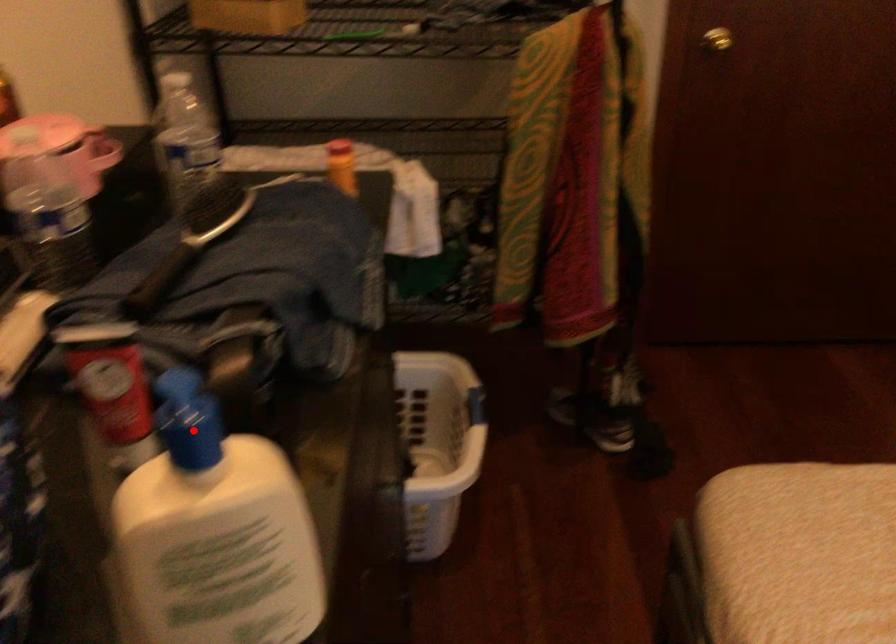
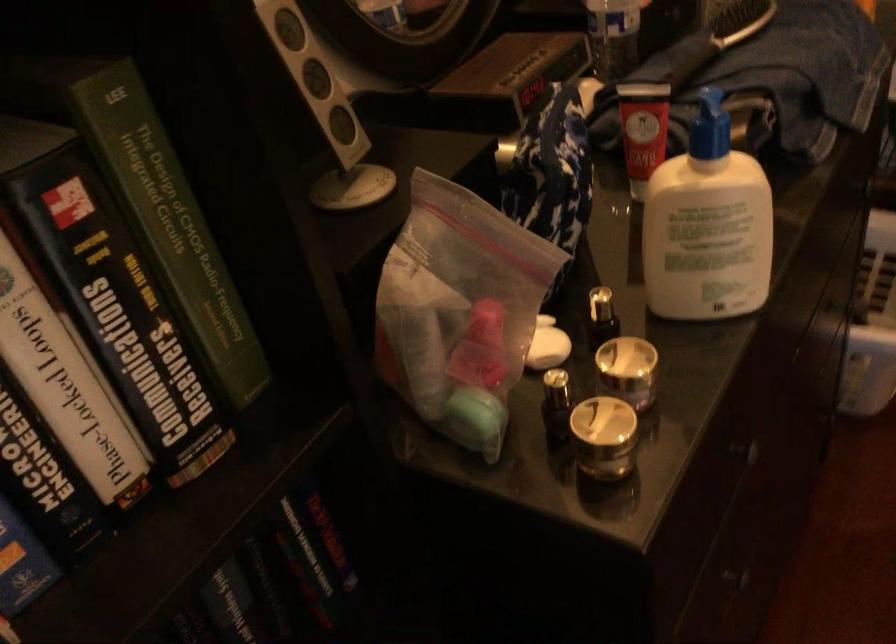
Question: I am providing you with two images of the same scene from different viewpoints. A red point is marked on the first image. Can you still see the location of the red point in image 2?

Choices:
 (A) Yes
 (B) No

Answer: (A)